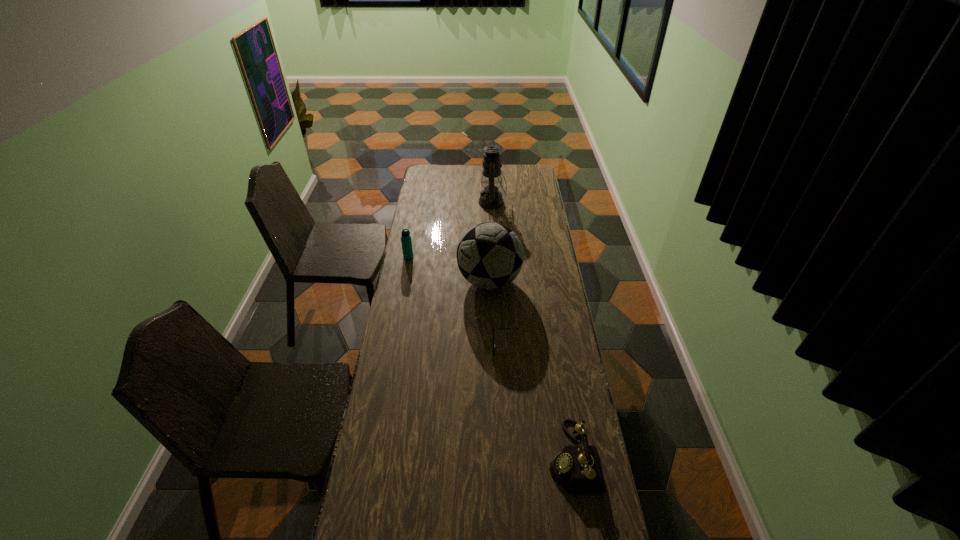
The image size is (960, 540). Identify the location of the farthest object. (490, 198).

Where is `the second tallest object`? The height and width of the screenshot is (540, 960). the second tallest object is located at coordinates (490, 255).

The width and height of the screenshot is (960, 540). I want to click on the third nearest object, so click(x=490, y=255).

Identify the location of the leftmost object. This screenshot has height=540, width=960. (406, 242).

The height and width of the screenshot is (540, 960). I want to click on the fourth nearest object, so click(406, 242).

Find the location of a particular element. The width and height of the screenshot is (960, 540). the nearest object is located at coordinates (576, 468).

Identify the location of telephone. (576, 468).

Where is `spectacles`? The image size is (960, 540). spectacles is located at coordinates (493, 328).

I want to click on the shortest object, so click(493, 328).

Image resolution: width=960 pixels, height=540 pixels. What are the coordinates of `vacant space located on the left of the farthest object` in the screenshot? It's located at (420, 202).